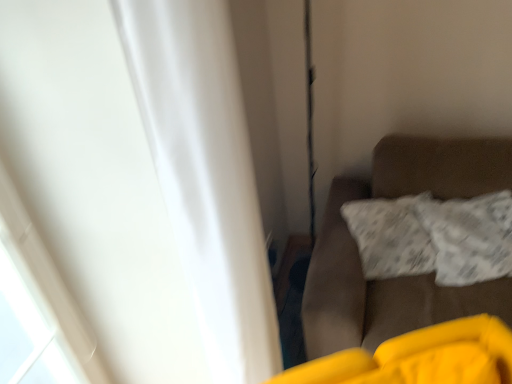
Question: From their relative heights in the image, would you say brown fabric couch at right is taller or shorter than white textured pillow at right?

Choices:
 (A) short
 (B) tall

Answer: (B)

Question: Which is correct: brown fabric couch at right is inside white textured pillow at right, or outside of it?

Choices:
 (A) inside
 (B) outside

Answer: (B)

Question: Based on their relative distances, which object is nearer to the white matte curtain at left?

Choices:
 (A) white textured pillow at right
 (B) brown fabric couch at right

Answer: (B)

Question: Based on their relative distances, which object is nearer to the white textured pillow at right?

Choices:
 (A) brown fabric couch at right
 (B) white matte curtain at left

Answer: (A)